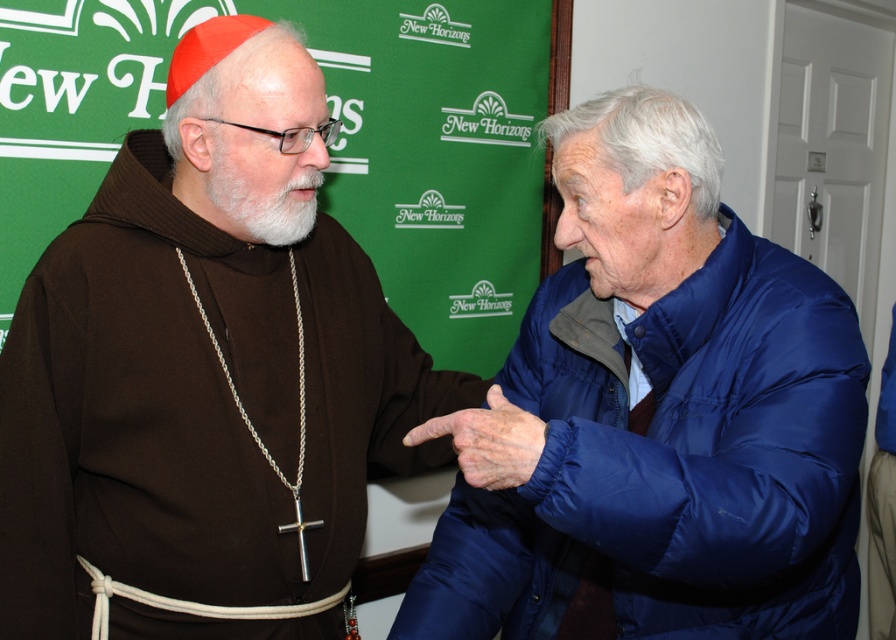
Question: Is blue puffy jacket at right wider than dry skin at center?

Choices:
 (A) yes
 (B) no

Answer: (A)

Question: Is brown woolen robe at left positioned before dry skin at center?

Choices:
 (A) no
 (B) yes

Answer: (A)

Question: Which of the following is the closest to the observer?

Choices:
 (A) dry skin at center
 (B) blue puffy jacket at right

Answer: (B)

Question: Estimate the real-world distances between objects in this image. Which object is closer to the blue puffy jacket at right?

Choices:
 (A) dry skin at center
 (B) brown woolen robe at left

Answer: (A)

Question: Is brown woolen robe at left in front of blue puffy jacket at right?

Choices:
 (A) yes
 (B) no

Answer: (B)

Question: Which point is closer to the camera taking this photo?

Choices:
 (A) (466, 468)
 (B) (260, 392)

Answer: (A)